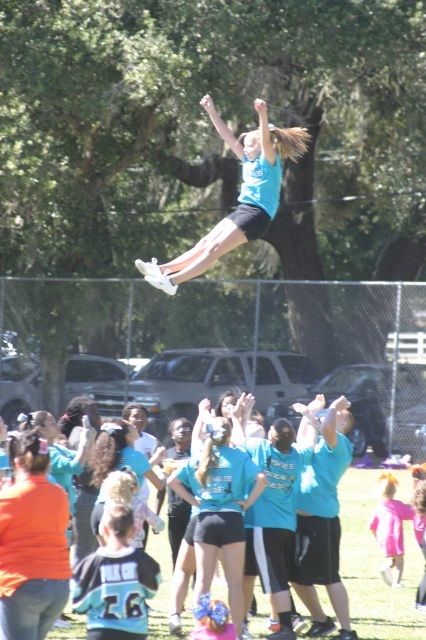
Is point (212, 496) in front of point (241, 236)?

Yes, it is.

In the scene shown: Between matte blue shirt at center and matte blue tank top at center, which one has less height?

With less height is matte blue shirt at center.

Is point (241, 480) positioned before point (287, 134)?

Yes, it is.

At what (x,y) coordinates should I click in order to perform the action: click on matte blue shirt at center. Please return your answer as a coordinate pair (x, y). This screenshot has width=426, height=640. Looking at the image, I should click on (219, 509).

Is matte blue tank top at center taller than pink satin dress at lower right?

Yes, matte blue tank top at center is taller than pink satin dress at lower right.

Who is positioned more to the right, matte blue tank top at center or pink satin dress at lower right?

pink satin dress at lower right is more to the right.

Is point (281, 177) positioned in front of point (394, 488)?

No, (281, 177) is further to viewer.

Locate an element on the screen. Image resolution: width=426 pixels, height=640 pixels. matte blue tank top at center is located at coordinates (238, 196).

Does matte blue shirt at center have a greater height compared to pink satin dress at lower right?

Yes, matte blue shirt at center is taller than pink satin dress at lower right.

Based on the photo, who is more forward, [238,604] or [382,500]?

Point [238,604]

Which is behind, point (235, 509) or point (388, 516)?

Point (388, 516)

Locate an element on the screen. Image resolution: width=426 pixels, height=640 pixels. matte blue shirt at center is located at coordinates (219, 509).